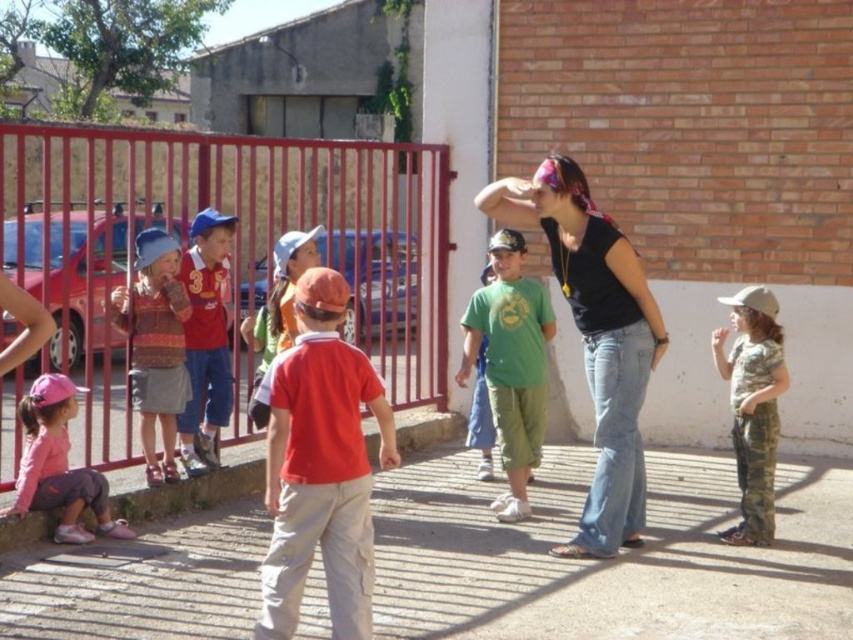
Is point (738, 344) farther from camera compared to point (22, 513)?

That is True.

Is camouflage pants at right positioned in front of pink fabric cap at lower left?

No.

Identify the location of camouflage pants at right. (752, 406).

Locate an element on the screen. The height and width of the screenshot is (640, 853). camouflage pants at right is located at coordinates (752, 406).

Which is behind, point (112, 321) or point (209, 278)?

Positioned behind is point (209, 278).

From the picture: Is striped sweater at left shorter than matte red shirt at center?

Yes, striped sweater at left is shorter than matte red shirt at center.

Is point (138, 320) farther from viewer compared to point (206, 209)?

That is False.

The image size is (853, 640). I want to click on striped sweater at left, so click(x=155, y=346).

Which is in front, point (761, 406) or point (131, 344)?

Positioned in front is point (761, 406).

Is point (726, 536) in front of point (154, 442)?

That is True.

Which is behind, point (746, 289) or point (173, 321)?

Positioned behind is point (746, 289).

Find the location of `camouflage pants at right`. camouflage pants at right is located at coordinates (752, 406).